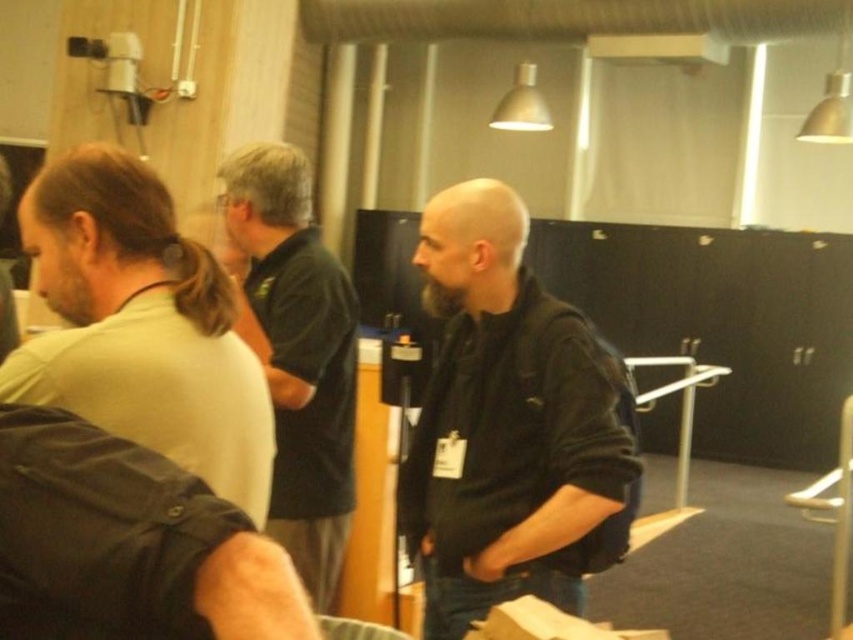
Question: Among these points, which one is nearest to the camera?

Choices:
 (A) (485, 198)
 (B) (253, 346)
 (C) (73, 172)

Answer: (C)

Question: Among these objects, which one is nearest to the camera?

Choices:
 (A) dark green jersey at center
 (B) light green shirt at left
 (C) black matte jacket at center

Answer: (B)

Question: Considering the relative positions of light green shirt at left and dark green jersey at center in the image provided, where is light green shirt at left located with respect to dark green jersey at center?

Choices:
 (A) above
 (B) below

Answer: (A)

Question: Is light green shirt at left to the left of dark green jersey at center from the viewer's perspective?

Choices:
 (A) yes
 (B) no

Answer: (A)

Question: Observing the image, what is the correct spatial positioning of black matte jacket at center in reference to light green shirt at left?

Choices:
 (A) right
 (B) left

Answer: (A)

Question: Which point appears farthest from the camera in this image?

Choices:
 (A) (64, 232)
 (B) (352, 307)
 (C) (498, 310)

Answer: (B)